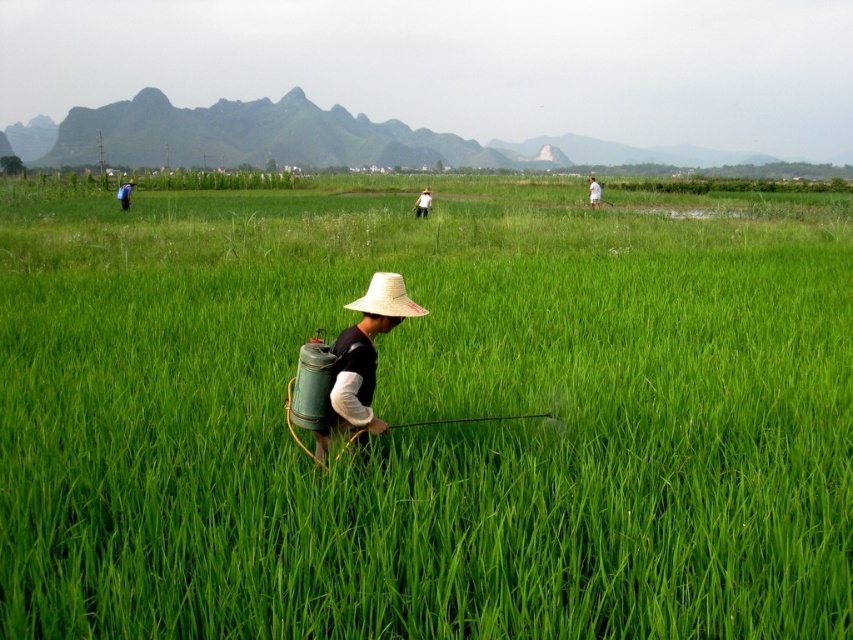
You are a farmer checking the growth of your crops. You notice the green grass at center and the matte straw hat at center. Which one is taller?

The green grass at center is taller than the matte straw hat at center.

Where is the blue fabric shirt at left located in the image?

The blue fabric shirt at left is located at point (125, 193) in the image.

You are a farmer planning to wear both the white straw hat at center and the blue fabric shirt at left. Which clothing item has a smaller width?

The white straw hat at center has a lesser width compared to the blue fabric shirt at left, so the white straw hat at center is smaller in width.